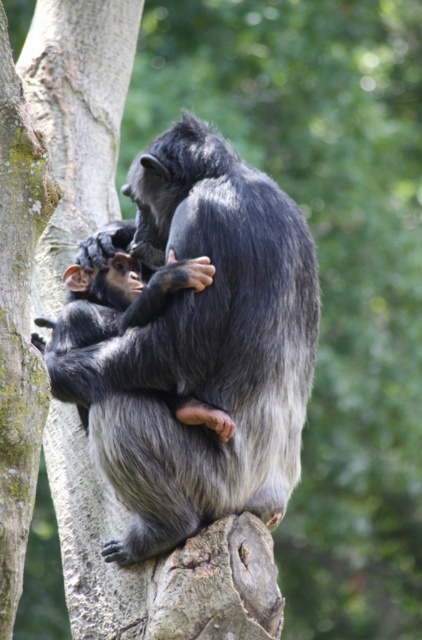
What is located at the coordinates point (199,348)?

The gray furry monkey at center is located at point (199,348).

Consider the image. You are a wildlife photographer aiming to capture a closeup shot of both the gray furry monkey at center and the shiny black monkey at center. Given that your camera lens has a maximum width coverage of 1.2 meters, can you fit both monkeys into the frame without cropping?

The gray furry monkey at center is wider than the shiny black monkey at center. However, since the exact widths are not provided, it is impossible to determine if their combined width exceeds the 1.2 meters limit. Therefore, you might need to adjust your position or use a wider lens to ensure both are in frame.